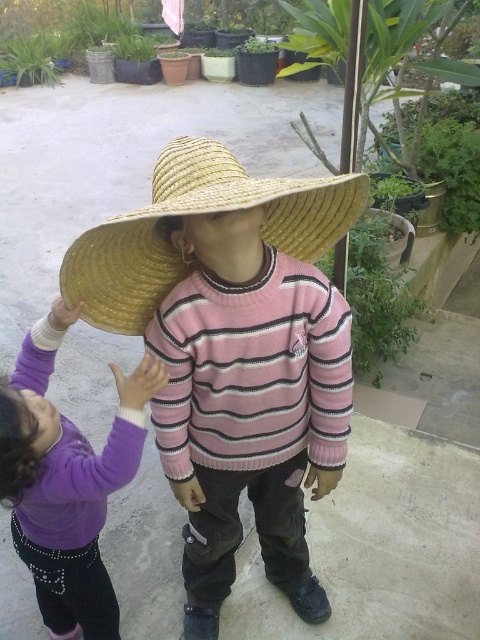
Consider the image. You are a photographer trying to capture a candid shot of the two children. You want to position yourself so that you can see both the purple fleece sweater at center and the straw hat at center in the frame. Based on their positions, which side of the scene should you stand to ensure both are visible?

To capture both the purple fleece sweater at center and the straw hat at center in the frame, you should stand on the right side of the scene. Since the purple fleece sweater at center is to the left of the straw hat at center, positioning yourself to the right will allow you to include both objects in your shot.

You are a photographer trying to capture the purple fleece sweater at center in the image. The camera has a focal point that can only be set at point coordinates. The scene has a point at coordinates (x=67, y=481). Is this point the correct focal point to focus on the purple fleece sweater at center?

Yes, the point at coordinates (x=67, y=481) indicates the purple fleece sweater at center, so setting the focal point there will correctly focus on the purple fleece sweater at center.

You are a fashion designer observing two children in a garden. The children are wearing the purple fleece sweater at center and the straw hat at center. Which clothing item is narrower?

The purple fleece sweater at center is narrower than the straw hat at center.